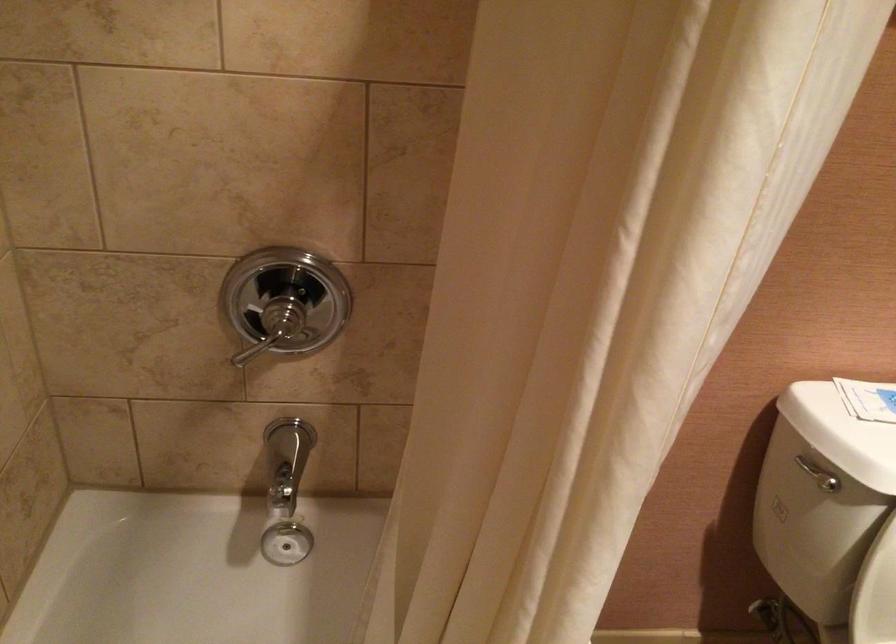
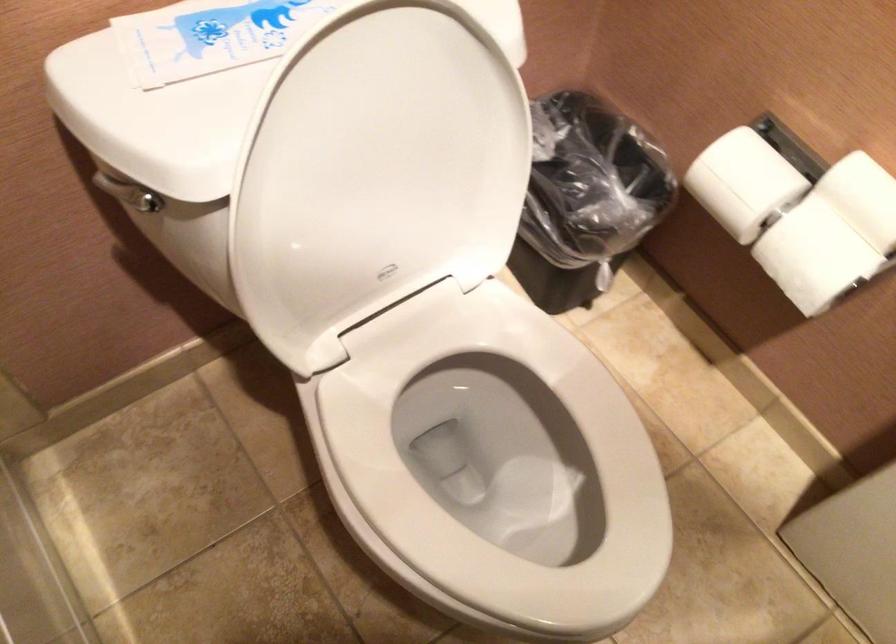
Based on the continuous images, in which direction is the camera rotating?

The camera rotated toward right-down.